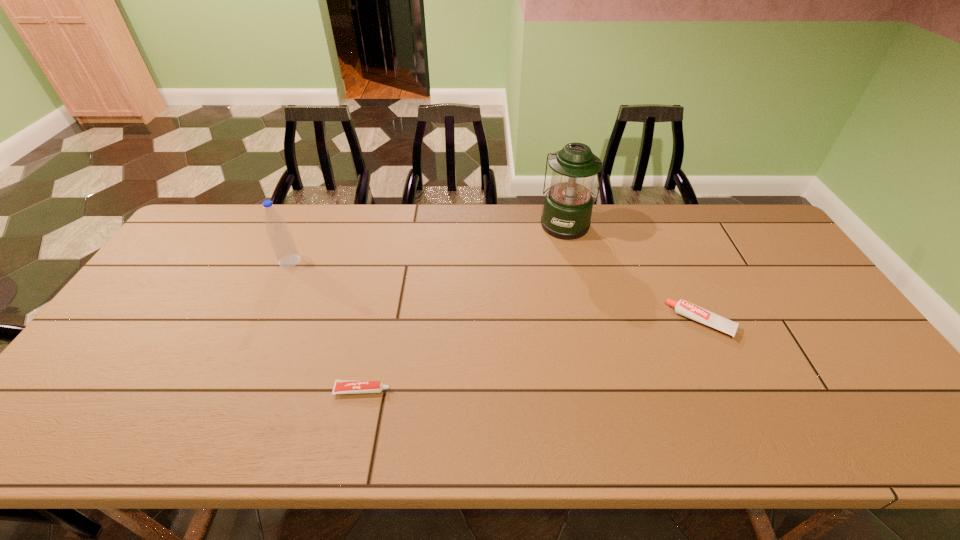
This screenshot has width=960, height=540. Identify the location of the farthest object. (567, 211).

Where is `lantern`? lantern is located at coordinates (567, 211).

You are a GUI agent. You are given a task and a screenshot of the screen. Output one action in this format:
    pyautogui.click(x=<x>, y=<y>)
    Task: Click on the second farthest object
    
    Given the screenshot: What is the action you would take?
    pyautogui.click(x=281, y=240)

The width and height of the screenshot is (960, 540). What are the coordinates of `the leftmost object` in the screenshot? It's located at 281,240.

This screenshot has width=960, height=540. I want to click on the taller toothpaste, so click(682, 307).

The height and width of the screenshot is (540, 960). What are the coordinates of `the rightmost object` in the screenshot? It's located at (682, 307).

At what (x,y) coordinates should I click in order to perform the action: click on the left toothpaste. Please return your answer as a coordinate pair (x, y). Looking at the image, I should click on (341, 386).

The height and width of the screenshot is (540, 960). What are the coordinates of `the third object from right to left` in the screenshot? It's located at (341, 386).

Where is `vacant space located on the left of the lantern`? This screenshot has height=540, width=960. vacant space located on the left of the lantern is located at coordinates (459, 224).

The width and height of the screenshot is (960, 540). What are the coordinates of `vacant area situated 0.320m on the right of the third nearest object` in the screenshot? It's located at (402, 261).